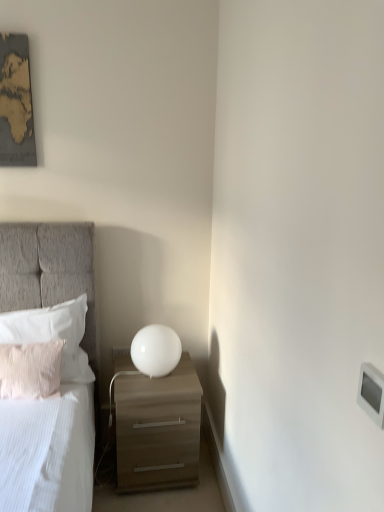
Identify the location of vacant space in front of white glossy sphere at center. (152, 390).